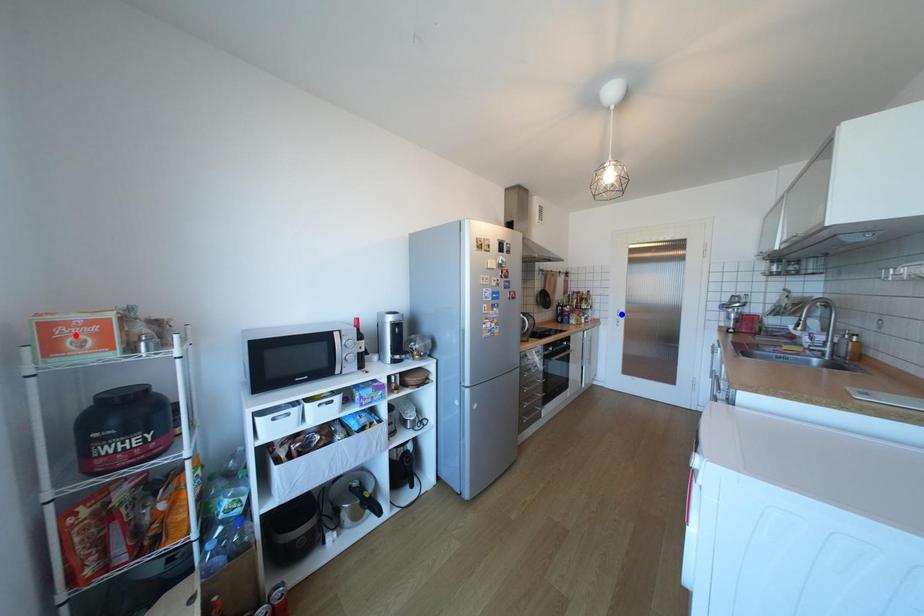
Question: Two points are marked on the image. Which point is closer to the camera?

Choices:
 (A) Blue point is closer.
 (B) Red point is closer.

Answer: (B)